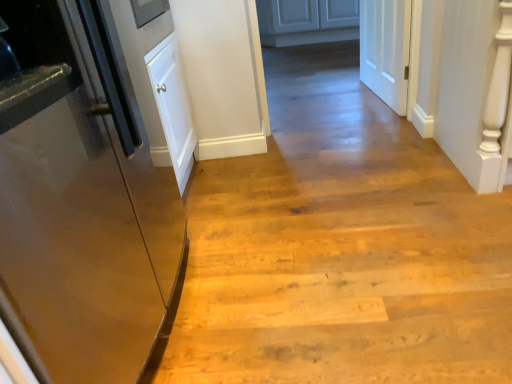
Question: From a real-world perspective, is white matte door at upper right, which is the 2th door from left to right, located beneath matte white cabinets at center?

Choices:
 (A) no
 (B) yes

Answer: (A)

Question: Is white matte door at upper right, arranged as the second door when viewed from the front, facing towards matte white cabinets at center?

Choices:
 (A) yes
 (B) no

Answer: (B)

Question: Does white matte door at upper right, which is the second door from bottom to top, have a greater height compared to matte white cabinets at center?

Choices:
 (A) no
 (B) yes

Answer: (B)

Question: Is matte white cabinets at center at the back of white matte door at upper right, the first door from the top?

Choices:
 (A) yes
 (B) no

Answer: (B)

Question: Is the depth of white matte door at upper right, arranged as the second door when viewed from the front, less than that of matte white cabinets at center?

Choices:
 (A) no
 (B) yes

Answer: (B)

Question: From the image's perspective, would you say white matte door at upper right, the 1th door when ordered from right to left, is positioned over matte white cabinets at center?

Choices:
 (A) yes
 (B) no

Answer: (B)

Question: From the image's perspective, would you say glossy metallic refrigerator at left, the 1th door positioned from the bottom, is shown under white matte door at upper right, which is the 2th door from left to right?

Choices:
 (A) yes
 (B) no

Answer: (A)

Question: Does glossy metallic refrigerator at left, the second door in the right-to-left sequence, contain white matte door at upper right, which is the second door from bottom to top?

Choices:
 (A) no
 (B) yes

Answer: (A)

Question: Is glossy metallic refrigerator at left, the second door in the right-to-left sequence, shorter than white matte door at upper right, arranged as the second door when viewed from the front?

Choices:
 (A) yes
 (B) no

Answer: (B)

Question: Is glossy metallic refrigerator at left, which ranks as the 1th door in left-to-right order, turned away from white matte door at upper right, the first door from the top?

Choices:
 (A) no
 (B) yes

Answer: (A)

Question: Is glossy metallic refrigerator at left, which ranks as the 1th door in left-to-right order, smaller than white matte door at upper right, the first door from the top?

Choices:
 (A) yes
 (B) no

Answer: (B)

Question: Is glossy metallic refrigerator at left, which is the 2th door from back to front, to the left of white matte door at upper right, the first door from the top, from the viewer's perspective?

Choices:
 (A) yes
 (B) no

Answer: (A)

Question: Is glossy metallic refrigerator at left, the second door in the right-to-left sequence, thinner than matte white cabinets at center?

Choices:
 (A) yes
 (B) no

Answer: (A)